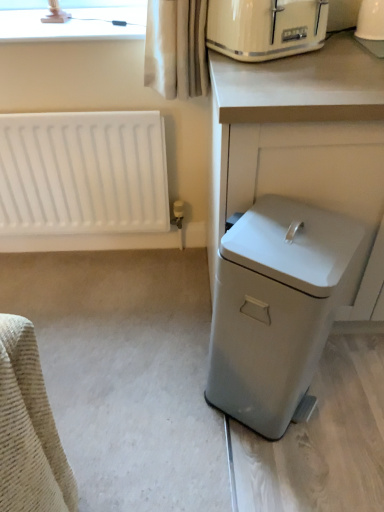
Question: Is white glossy coffee maker at upper right to the right of matte cream toaster at upper right from the viewer's perspective?

Choices:
 (A) yes
 (B) no

Answer: (A)

Question: Considering the relative sizes of white glossy coffee maker at upper right and matte cream toaster at upper right in the image provided, is white glossy coffee maker at upper right taller than matte cream toaster at upper right?

Choices:
 (A) yes
 (B) no

Answer: (A)

Question: Is white glossy coffee maker at upper right at the left side of matte cream toaster at upper right?

Choices:
 (A) no
 (B) yes

Answer: (A)

Question: From a real-world perspective, is white glossy coffee maker at upper right over matte cream toaster at upper right?

Choices:
 (A) no
 (B) yes

Answer: (B)

Question: Is matte cream toaster at upper right at the back of white glossy coffee maker at upper right?

Choices:
 (A) yes
 (B) no

Answer: (B)

Question: In terms of height, does white glossy coffee maker at upper right look taller or shorter compared to white plastic trash can at right?

Choices:
 (A) tall
 (B) short

Answer: (B)

Question: Would you say white glossy coffee maker at upper right is inside or outside white plastic trash can at right?

Choices:
 (A) outside
 (B) inside

Answer: (A)

Question: Considering their positions, is white glossy coffee maker at upper right located in front of or behind white plastic trash can at right?

Choices:
 (A) behind
 (B) front

Answer: (A)

Question: Considering the positions of point (362, 13) and point (309, 54), is point (362, 13) closer or farther from the camera than point (309, 54)?

Choices:
 (A) farther
 (B) closer

Answer: (A)

Question: In terms of width, does white plastic trash can at right look wider or thinner when compared to matte white lampshade at upper left?

Choices:
 (A) wide
 (B) thin

Answer: (A)

Question: Is white plastic trash can at right taller or shorter than matte white lampshade at upper left?

Choices:
 (A) short
 (B) tall

Answer: (B)

Question: In terms of size, does white plastic trash can at right appear bigger or smaller than matte white lampshade at upper left?

Choices:
 (A) small
 (B) big

Answer: (B)

Question: Choose the correct answer: Is white plastic trash can at right inside matte white lampshade at upper left or outside it?

Choices:
 (A) inside
 (B) outside

Answer: (B)

Question: From a real-world perspective, is matte cream toaster at upper right above or below white plastic trash can at right?

Choices:
 (A) above
 (B) below

Answer: (A)

Question: Is matte cream toaster at upper right inside the boundaries of white plastic trash can at right, or outside?

Choices:
 (A) outside
 (B) inside

Answer: (A)